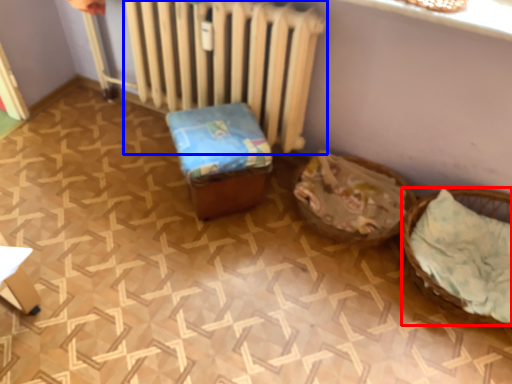
Question: Which of the following is the farthest to the observer, basket (highlighted by a red box) or radiator (highlighted by a blue box)?

Choices:
 (A) basket
 (B) radiator

Answer: (B)